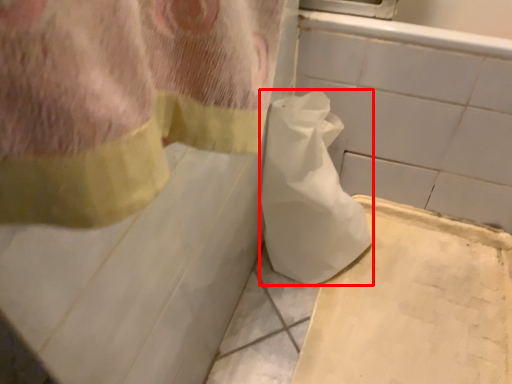
Question: Considering the relative positions of toilet paper (annotated by the red box) and cardboard in the image provided, where is toilet paper (annotated by the red box) located with respect to the staircase?

Choices:
 (A) left
 (B) right

Answer: (A)